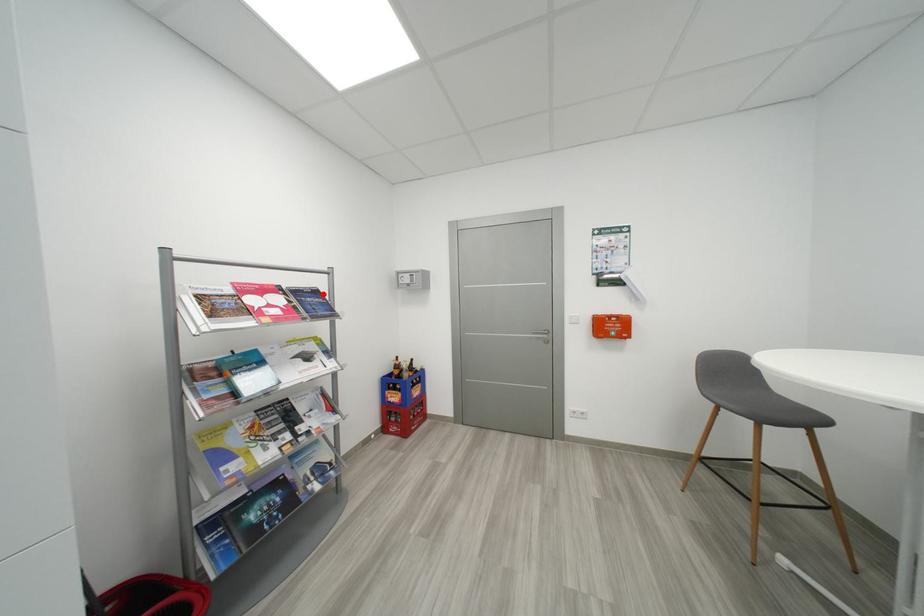
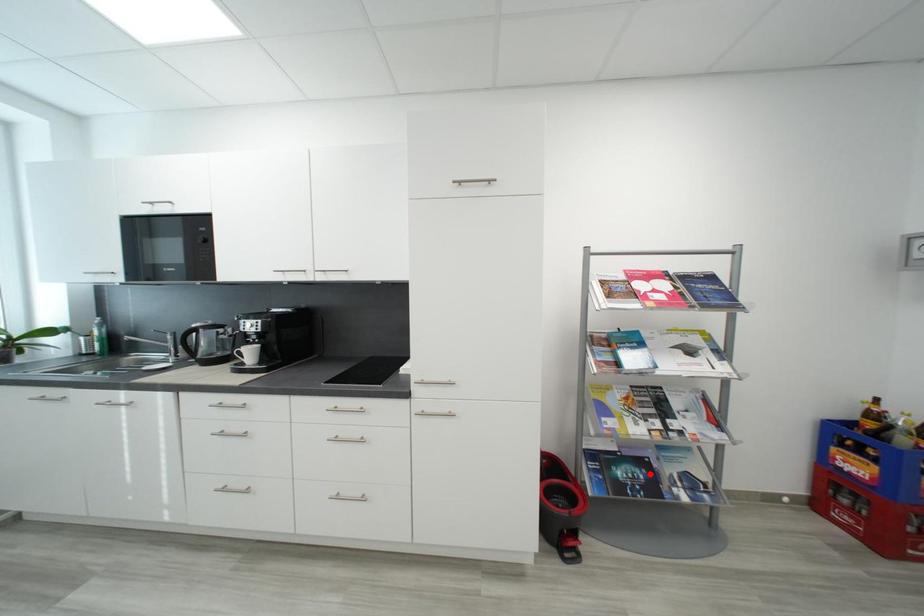
I am providing you with two images of the same scene from different viewpoints. A red point is marked on the first image and another point is marked on the second image. Is the marked point in image1 the same physical position as the marked point in image2?

No